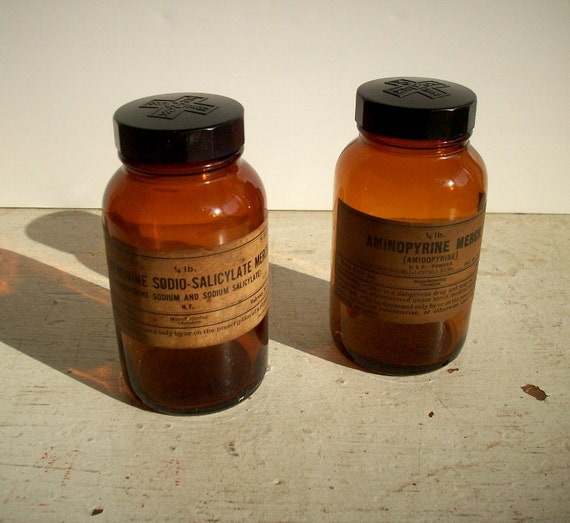
You are a GUI agent. You are given a task and a screenshot of the screen. Output one action in this format:
    pyautogui.click(x=<x>, y=<y>)
    Task: Click on the white wall
    
    Given the screenshot: What is the action you would take?
    pyautogui.click(x=285, y=79)